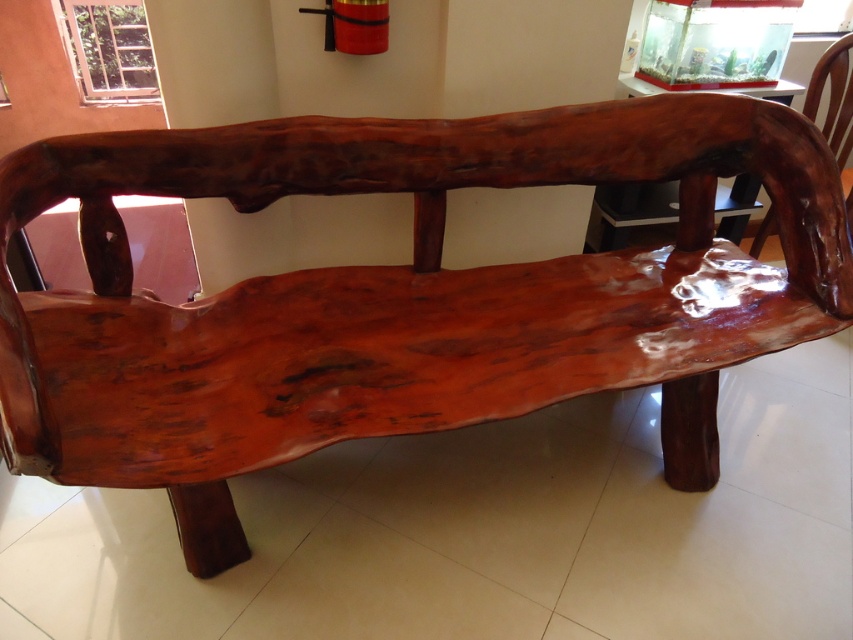
Question: Does glossy wood table at upper center come in front of glossy wood chair at upper right?

Choices:
 (A) yes
 (B) no

Answer: (A)

Question: Which of the following is the farthest from the observer?

Choices:
 (A) (637, 188)
 (B) (817, 65)

Answer: (A)

Question: Does glossy wood table at upper center have a greater width compared to glossy wood chair at upper right?

Choices:
 (A) yes
 (B) no

Answer: (A)

Question: Is glossy wood table at upper center thinner than glossy wood chair at upper right?

Choices:
 (A) yes
 (B) no

Answer: (B)

Question: Among these objects, which one is nearest to the camera?

Choices:
 (A) glossy wood table at upper center
 (B) glossy wood chair at upper right

Answer: (A)